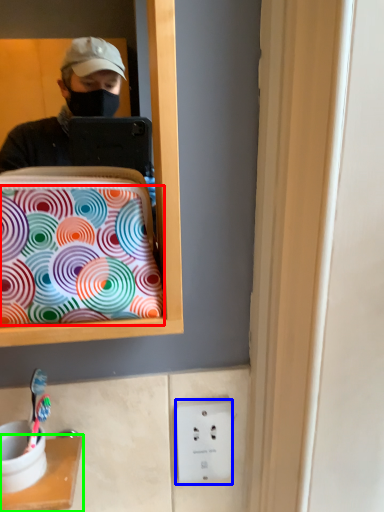
Question: Considering the real-world distances, which object is closest to pattern (highlighted by a red box)? electric outlet (highlighted by a blue box) or furniture (highlighted by a green box).

Choices:
 (A) electric outlet
 (B) furniture

Answer: (B)